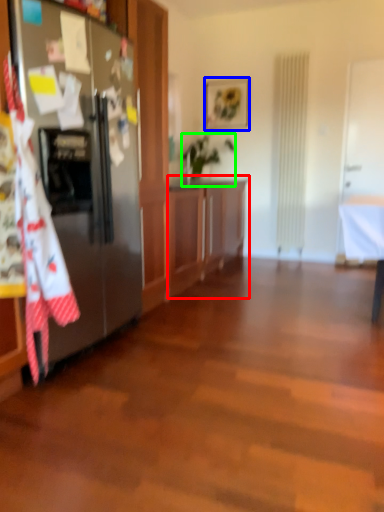
Question: Considering the real-world distances, which object is closest to cabinetry (highlighted by a red box)? picture frame (highlighted by a blue box) or houseplant (highlighted by a green box).

Choices:
 (A) picture frame
 (B) houseplant

Answer: (B)